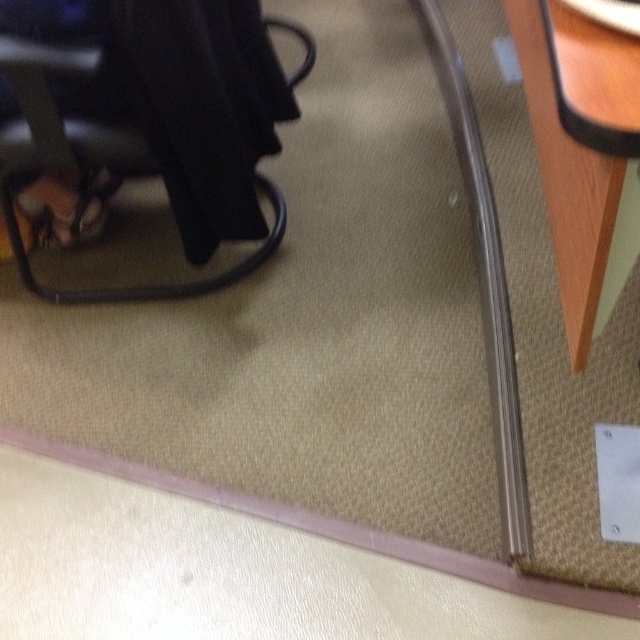
Does point (605, 209) come farther from viewer compared to point (92, 230)?

No.

Does wooden table at lower right appear on the right side of brown leather sandal at lower left?

Yes, wooden table at lower right is to the right of brown leather sandal at lower left.

This screenshot has height=640, width=640. Find the location of `wooden table at lower right`. wooden table at lower right is located at coordinates (582, 154).

Does point (592, 20) come in front of point (22, 260)?

Yes, it is in front of point (22, 260).

Who is positioned more to the right, wooden table at lower right or matte black chair at lower left?

From the viewer's perspective, wooden table at lower right appears more on the right side.

Does point (538, 44) come farther from viewer compared to point (132, 300)?

No, (538, 44) is closer to viewer.

Identify the location of wooden table at lower right. (582, 154).

Between matte black chair at lower left and brown leather sandal at lower left, which one appears on the right side from the viewer's perspective?

matte black chair at lower left is more to the right.

Which of these two, matte black chair at lower left or brown leather sandal at lower left, stands taller?

matte black chair at lower left

Which is in front, point (288, 86) or point (58, 188)?

Point (58, 188)

Find the location of `matte black chair at lower left`. matte black chair at lower left is located at coordinates (141, 285).